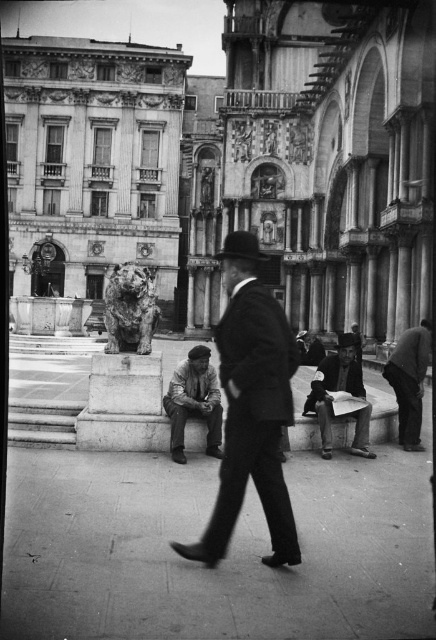
Can you confirm if rustic stone lion at center is thinner than black felt fedora at center?

No.

Locate an element on the screen. rustic stone lion at center is located at coordinates (129, 308).

Consider the image. Does smooth black suit at center appear on the right side of smooth paper at center?

Incorrect, smooth black suit at center is not on the right side of smooth paper at center.

Looking at this image, can you confirm if smooth black suit at center is bigger than smooth paper at center?

Yes, smooth black suit at center is bigger than smooth paper at center.

At what (x,y) coordinates should I click in order to perform the action: click on smooth black suit at center. Please return your answer as a coordinate pair (x, y). This screenshot has height=640, width=436. Looking at the image, I should click on (252, 417).

Does smooth paper at center appear over black felt fedora at center?

Incorrect, smooth paper at center is not positioned above black felt fedora at center.

Who is positioned more to the right, smooth paper at center or black felt fedora at center?

smooth paper at center is more to the right.

This screenshot has width=436, height=640. Describe the element at coordinates (340, 390) in the screenshot. I see `smooth paper at center` at that location.

Locate an element on the screen. This screenshot has width=436, height=640. smooth paper at center is located at coordinates (340, 390).